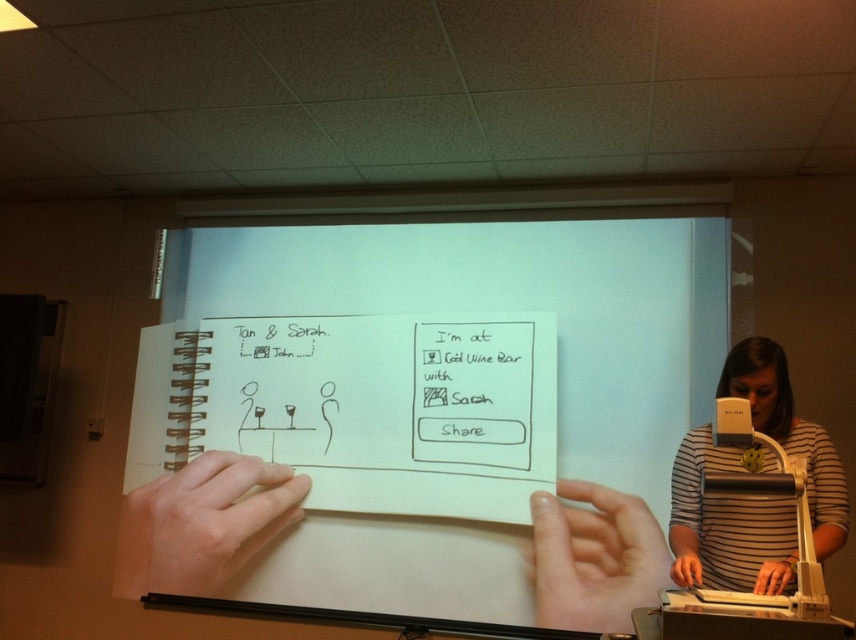
You are standing in front of the presentation screen and want to hand your colleague the white paper notebook at center. If you extend your arm fully, which typically reaches about 1.5 meters, will you be able to reach the notebook?

The white paper notebook at center is 3.05 meters away from the viewer. Since extending your arm only reaches about 1.5 meters, you cannot reach the notebook.

You are observing a presentation and notice two elements in the image. One is the striped cotton shirt at lower right and the other is the pale skin at center. Which of these two items is located to the right of the other?

The striped cotton shirt at lower right is positioned on the right side of pale skin at center.

You are an artist trying to sketch the scene shown on the slide. The white paper notebook at center and the smooth skin hand at lower center are in your view. Which object is wider?

The white paper notebook at center is wider than the smooth skin hand at lower center.